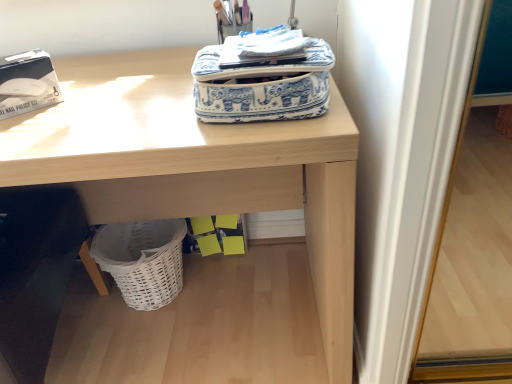
Question: Based on their sizes in the image, would you say blue and white fabric bag at upper center is bigger or smaller than white wicker basket at lower left?

Choices:
 (A) big
 (B) small

Answer: (B)

Question: From their relative heights in the image, would you say blue and white fabric bag at upper center is taller or shorter than white wicker basket at lower left?

Choices:
 (A) short
 (B) tall

Answer: (A)

Question: Which of these objects is positioned closest to the blue and white fabric bag at upper center?

Choices:
 (A) wooden desk at upper center
 (B) white wicker basket at lower left

Answer: (A)

Question: Estimate the real-world distances between objects in this image. Which object is farther from the blue and white fabric bag at upper center?

Choices:
 (A) white wicker basket at lower left
 (B) wooden desk at upper center

Answer: (A)